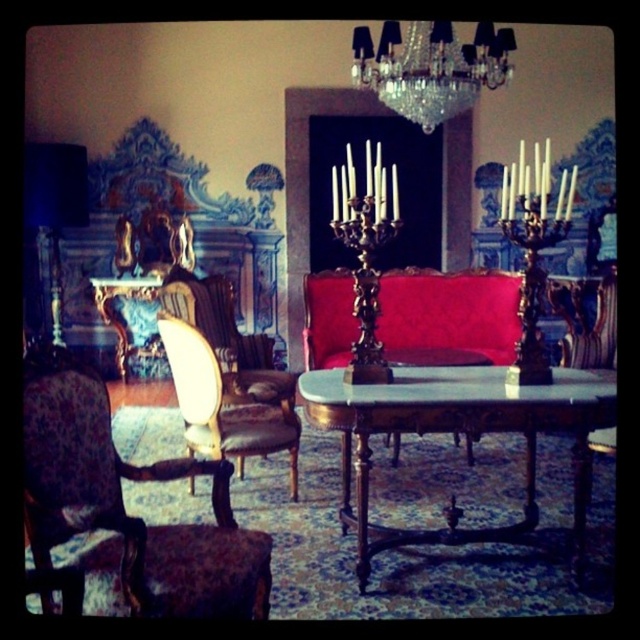
Question: Which is nearer to the velvet red couch at center?

Choices:
 (A) polished wood table at center
 (B) gold upholstered armchair at center
 (C) gold polished wood candle holder at center

Answer: (B)

Question: Can you confirm if crystal glass chandelier at upper center is wider than gold polished wood candle holder at center?

Choices:
 (A) yes
 (B) no

Answer: (A)

Question: Is the position of gold upholstered armchair at center more distant than that of gold polished wood candle holder at center?

Choices:
 (A) yes
 (B) no

Answer: (B)

Question: Which point appears farthest from the camera in this image?

Choices:
 (A) (532, 164)
 (B) (349, 321)

Answer: (A)

Question: Where is polished wood table at center located in relation to gold polished wood candle holder at center in the image?

Choices:
 (A) left
 (B) right

Answer: (B)

Question: Based on their relative distances, which object is nearer to the gold metallic candle holder at center?

Choices:
 (A) crystal glass chandelier at upper center
 (B) velvet-patterned armchair at left
 (C) blue fabric lampshade at left

Answer: (A)